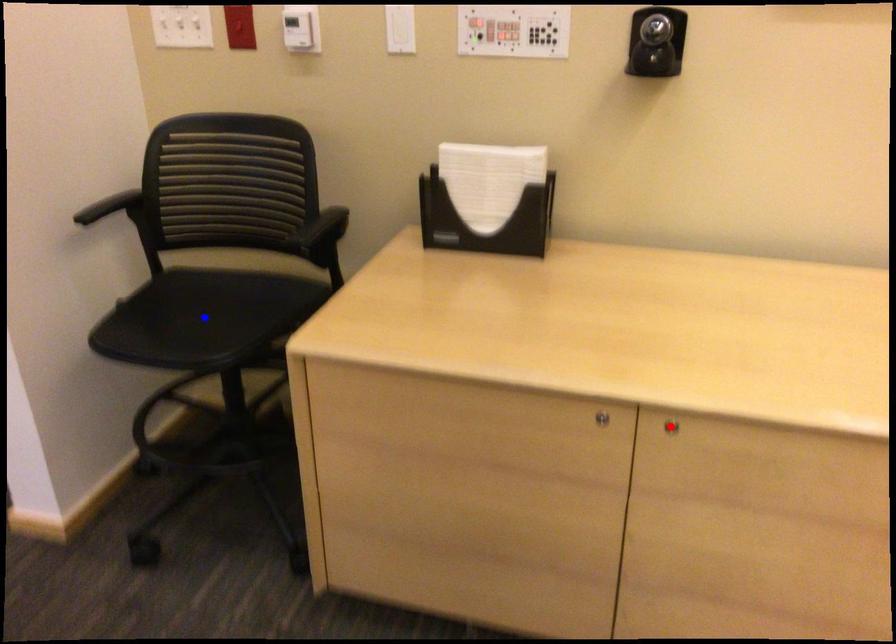
Question: Which of the two points in the image is closer to the camera?

Choices:
 (A) Blue point is closer.
 (B) Red point is closer.

Answer: (B)